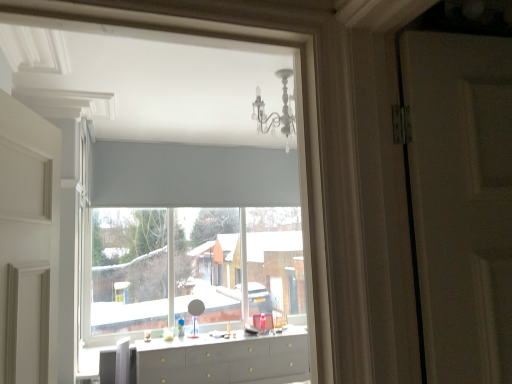
Question: From the image's perspective, is white matte window at center beneath white glossy counter top at center?

Choices:
 (A) no
 (B) yes

Answer: (A)

Question: Does white matte window at center appear on the left side of white glossy counter top at center?

Choices:
 (A) yes
 (B) no

Answer: (A)

Question: Is white matte window at center positioned with its back to white glossy counter top at center?

Choices:
 (A) yes
 (B) no

Answer: (B)

Question: Is white matte window at center in front of white glossy counter top at center?

Choices:
 (A) no
 (B) yes

Answer: (A)

Question: Can you confirm if white matte window at center is smaller than white glossy counter top at center?

Choices:
 (A) yes
 (B) no

Answer: (B)

Question: From a real-world perspective, is white matte window at center on top of white glossy counter top at center?

Choices:
 (A) no
 (B) yes

Answer: (B)

Question: Is white matte window at center aimed at white plastic swivel chair at lower left?

Choices:
 (A) no
 (B) yes

Answer: (A)

Question: Is white matte window at center looking in the opposite direction of white plastic swivel chair at lower left?

Choices:
 (A) no
 (B) yes

Answer: (A)

Question: Is there a large distance between white matte window at center and white plastic swivel chair at lower left?

Choices:
 (A) yes
 (B) no

Answer: (A)

Question: Is white matte window at center further to camera compared to white plastic swivel chair at lower left?

Choices:
 (A) no
 (B) yes

Answer: (B)

Question: Is white matte window at center positioned before white plastic swivel chair at lower left?

Choices:
 (A) yes
 (B) no

Answer: (B)

Question: Is white matte window at center completely or partially outside of white plastic swivel chair at lower left?

Choices:
 (A) yes
 (B) no

Answer: (A)

Question: Considering the relative sizes of white plastic swivel chair at lower left and white matte window at center in the image provided, is white plastic swivel chair at lower left shorter than white matte window at center?

Choices:
 (A) yes
 (B) no

Answer: (A)